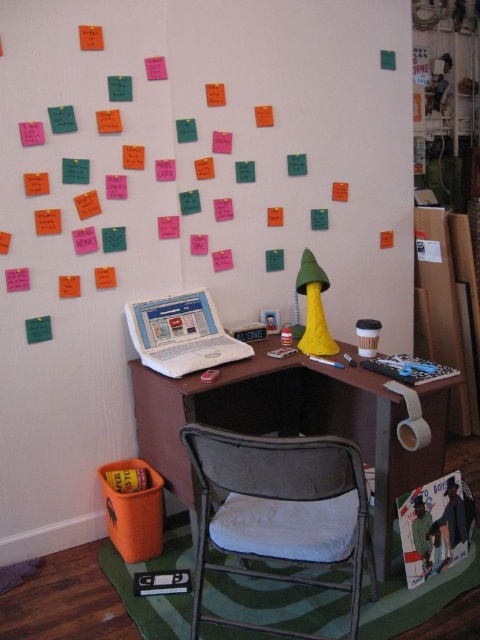
You are a person who is 6 feet tall and wants to sit at the desk. The metallic gray folding chair at center is the only chair available. Can you comfortably reach the white plastic laptop at center while sitting on the chair?

The distance between the metallic gray folding chair at center and the white plastic laptop at center is 22.52 inches, which is a standard desk distance. Since you are 6 feet tall, you can comfortably reach the white plastic laptop at center while sitting on the chair.

You are sitting in the workspace and want to move the metallic gray folding chair at center closer to the brown wood computer desk at center. Which object will be closer to you after moving the chair?

After moving the metallic gray folding chair at center closer to the brown wood computer desk at center, the metallic gray folding chair at center will now be closer to you since it was originally further away and you moved it forward.

You are organizing your workspace and need to move the white plastic laptop at center to the right side of the brown wood computer desk at center. Based on their current positions, is the laptop currently positioned to the left or right of the desk?

The brown wood computer desk at center is located below the white plastic laptop at center, so the laptop is positioned above the desk. Therefore, the laptop is not to the left or right of the desk but above it, so you cannot move it to the right side of the desk as it is already above the desk.